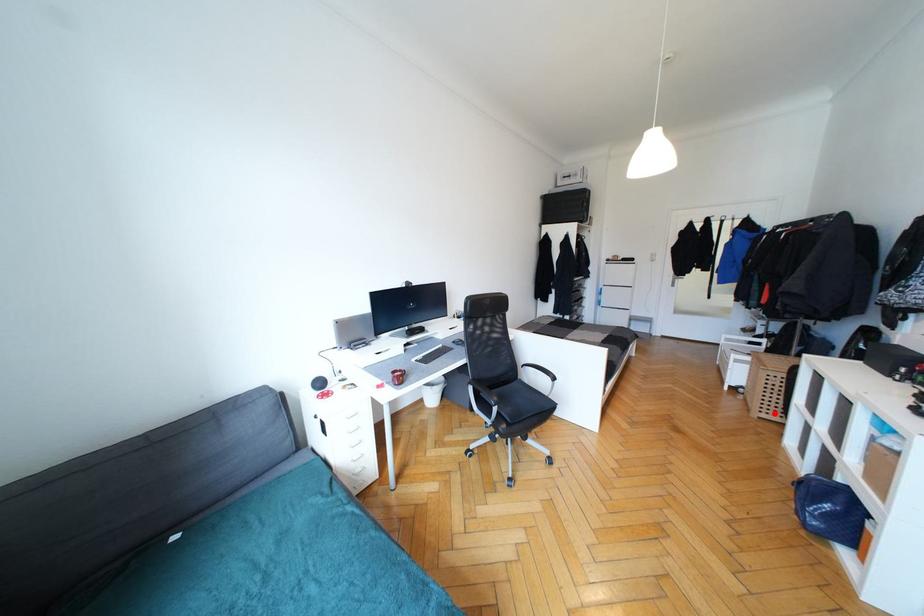
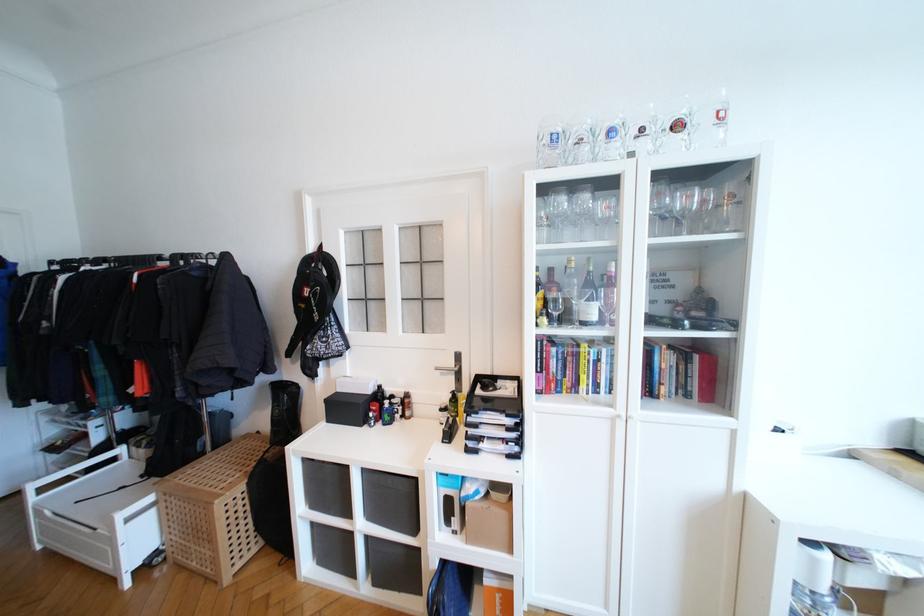
The point at the highlighted location is marked in the first image. Where is the corresponding point in the second image?

(248, 551)